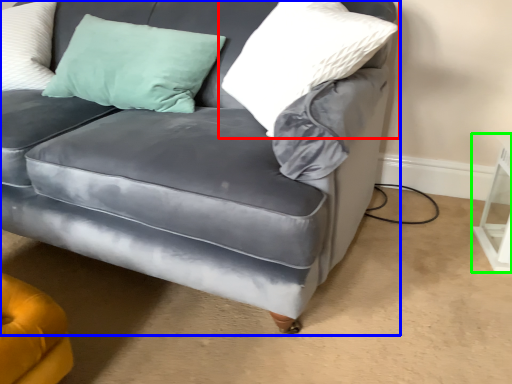
Question: Based on their relative distances, which object is farther from pillow (highlighted by a red box)? Choose from studio couch (highlighted by a blue box) and table (highlighted by a green box).

Choices:
 (A) studio couch
 (B) table

Answer: (B)